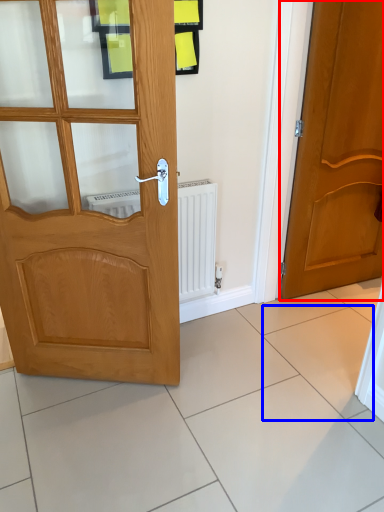
Question: Among these objects, which one is farthest to the camera, door (highlighted by a red box) or ceramic tile (highlighted by a blue box)?

Choices:
 (A) door
 (B) ceramic tile

Answer: (B)